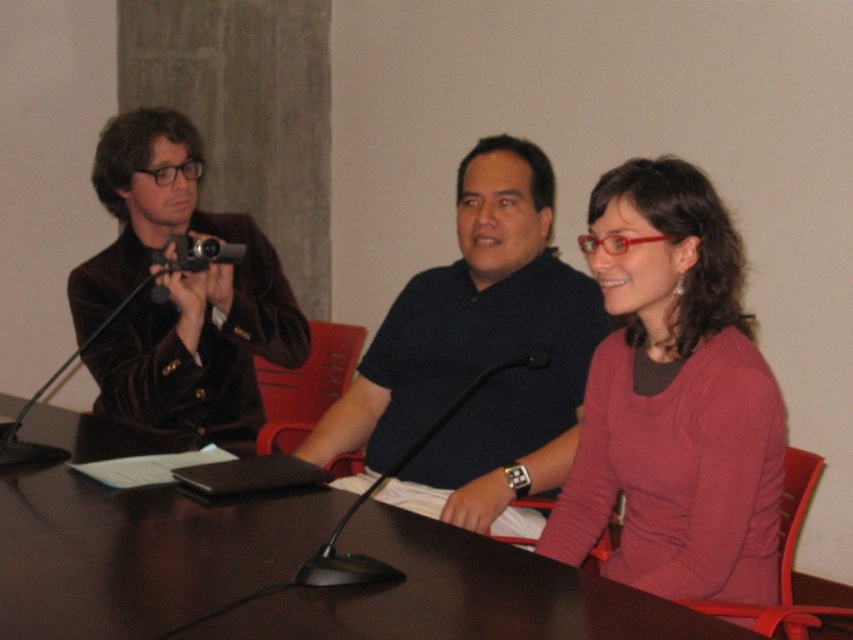
Question: Considering the relative positions of velvet brown jacket at left and black plastic camera at left in the image provided, where is velvet brown jacket at left located with respect to black plastic camera at left?

Choices:
 (A) right
 (B) left

Answer: (B)

Question: Which point is closer to the camera?

Choices:
 (A) [x=393, y=577]
 (B) [x=189, y=257]
 (C) [x=577, y=561]
 (D) [x=250, y=342]

Answer: (A)

Question: Is dark wood table at center further to the viewer compared to dark blue polo shirt at center?

Choices:
 (A) no
 (B) yes

Answer: (A)

Question: Observing the image, what is the correct spatial positioning of dark wood table at center in reference to black plastic camera at left?

Choices:
 (A) above
 (B) below

Answer: (B)

Question: Which point is closer to the camera taking this photo?

Choices:
 (A) (355, 582)
 (B) (538, 154)
 (C) (113, 156)

Answer: (A)

Question: Which object appears closest to the camera in this image?

Choices:
 (A) dark wood table at center
 (B) black plastic camera at left
 (C) pink sweater at center

Answer: (A)